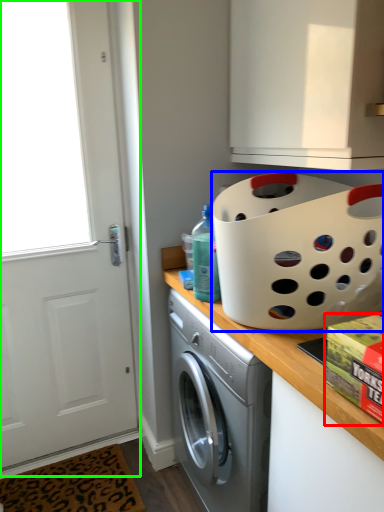
Question: Which object is positioned farthest from box (highlighted by a red box)? Select from basket (highlighted by a blue box) and screen door (highlighted by a green box).

Choices:
 (A) basket
 (B) screen door

Answer: (B)